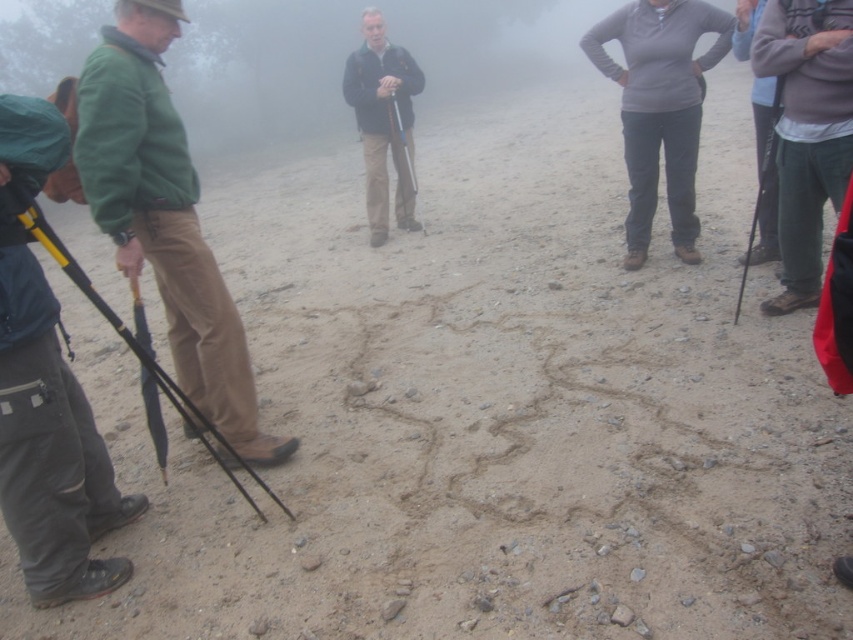
You are a photographer trying to capture a group photo of the people in the scene. You notice the gray matte pants at center and the matte black jacket at center. Which clothing item appears wider in the photo?

The gray matte pants at center appears wider than the matte black jacket at center in the photo because the gray matte pants at center has a greater width as described.

You are planning to take a photo of the dark gray fleece at upper right and the black rubber umbrella at left. Which object should you focus on first if you want to capture both in the same frame without moving the camera?

The dark gray fleece at upper right is taller than the black rubber umbrella at left, so you should focus on the dark gray fleece at upper right first to ensure it fits within the frame.